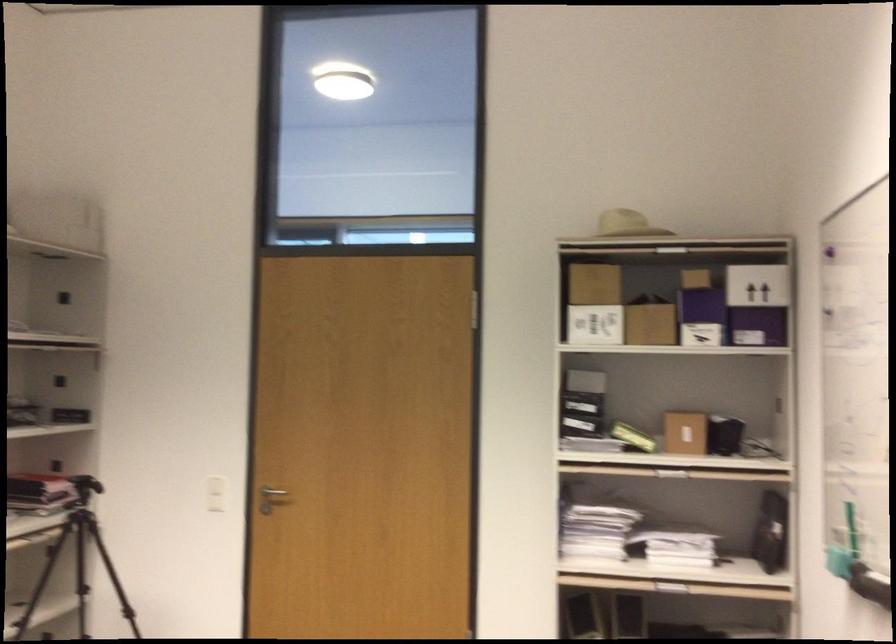
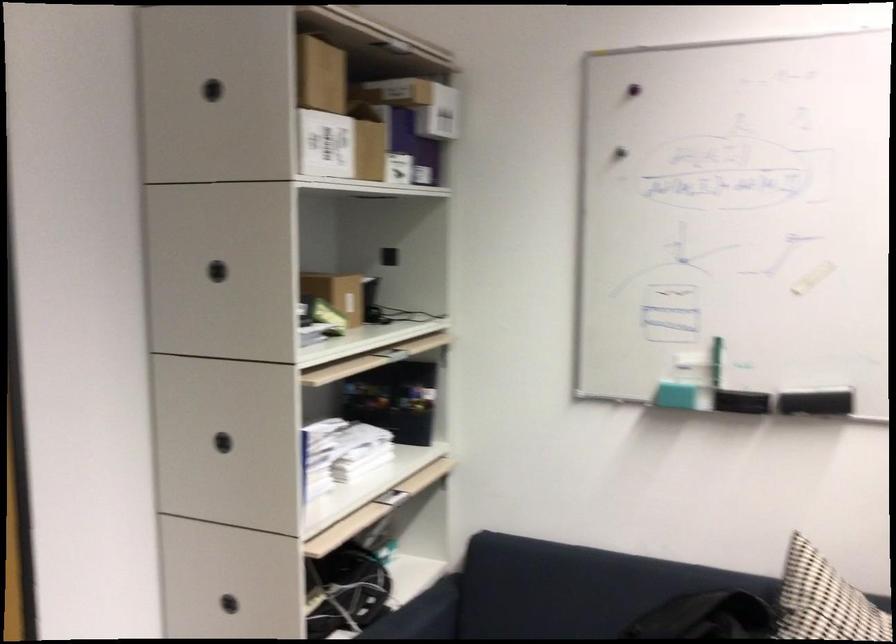
Locate, in the second image, the point that corresponds to the point at 582,290 in the first image.

(211, 90)